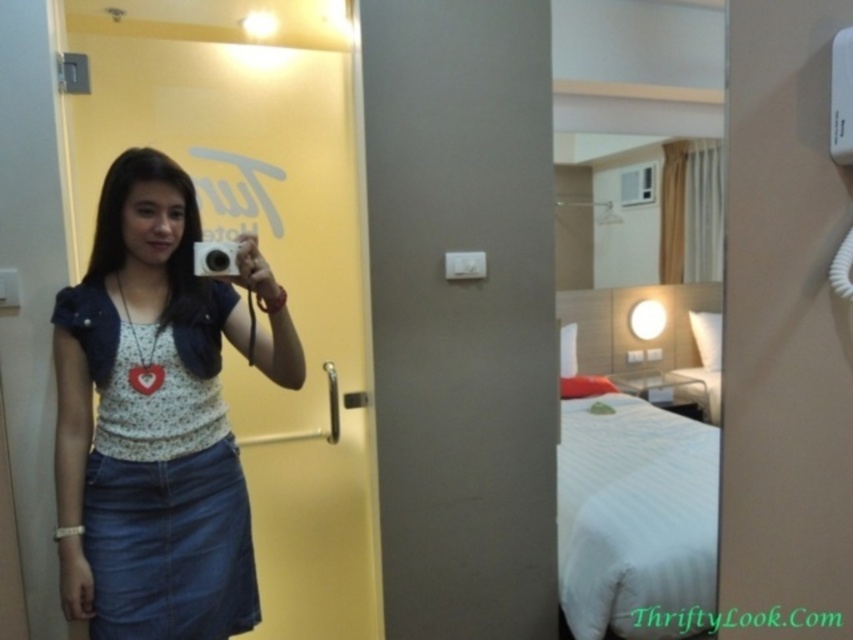
Is denim skirt at center further to the viewer compared to silver metallic camera at center?

No, it is in front of silver metallic camera at center.

Does point (154, 205) come in front of point (231, 257)?

No, (154, 205) is behind (231, 257).

Is point (161, 300) less distant than point (196, 246)?

No, (161, 300) is behind (196, 246).

At what (x,y) coordinates should I click in order to perform the action: click on denim skirt at center. Please return your answer as a coordinate pair (x, y). Looking at the image, I should click on (157, 417).